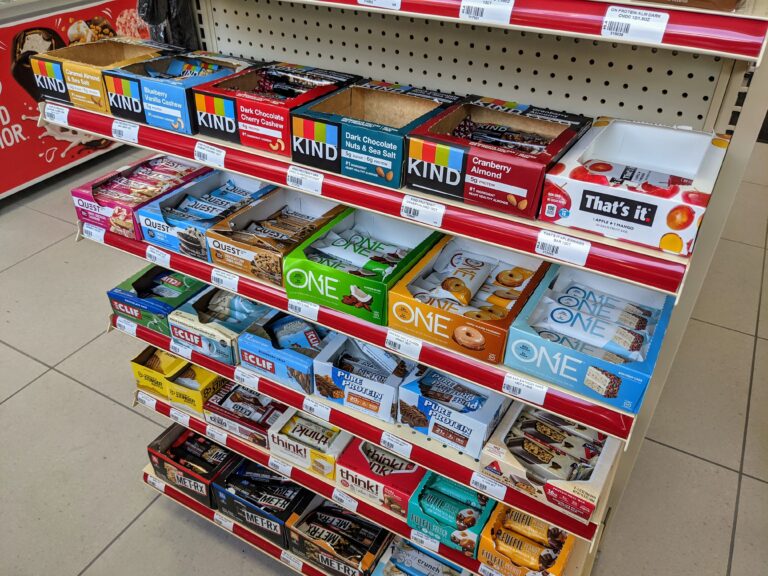
At what (x,y) coordinates should I click in order to perform the action: click on beige shelf wall. Please return your answer as a coordinate pair (x, y). Looking at the image, I should click on (396, 50), (560, 69).